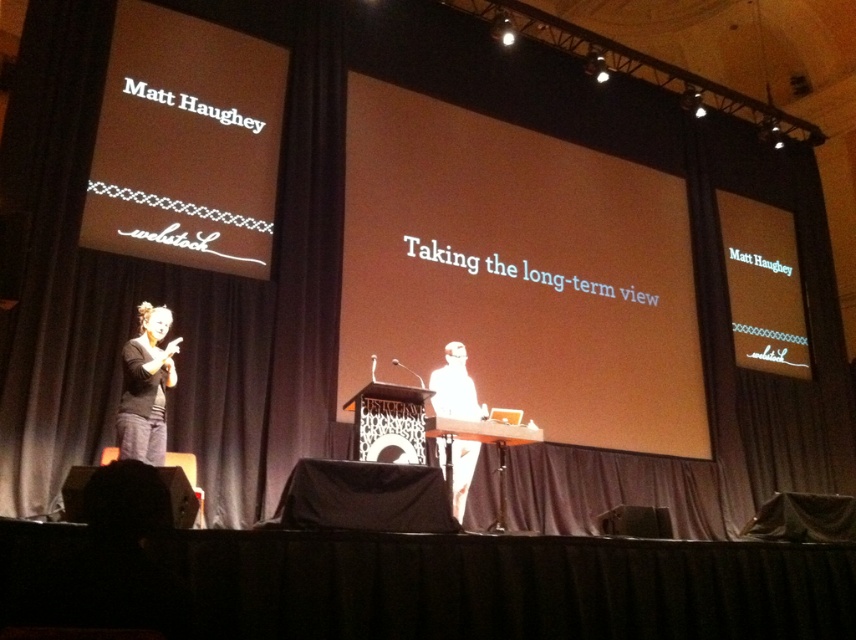
Question: Is dark gray curtain at left below black soft fabric at left?

Choices:
 (A) yes
 (B) no

Answer: (A)

Question: Is dark gray curtain at left to the left of black soft fabric at left from the viewer's perspective?

Choices:
 (A) yes
 (B) no

Answer: (B)

Question: Observing the image, what is the correct spatial positioning of black soft fabric at left in reference to white paper at center?

Choices:
 (A) below
 (B) above

Answer: (B)

Question: Which point is closer to the camera?

Choices:
 (A) dark gray curtain at left
 (B) white paper at center

Answer: (B)

Question: Which point appears closest to the camera in this image?

Choices:
 (A) (153, 310)
 (B) (446, 413)

Answer: (A)

Question: Which point appears closest to the camera in this image?

Choices:
 (A) (146, 330)
 (B) (119, 330)
 (C) (444, 348)

Answer: (A)